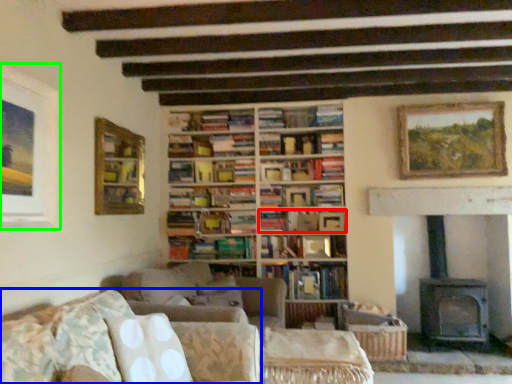
Question: Estimate the real-world distances between objects in this image. Which object is farther from book (highlighted by a red box), studio couch (highlighted by a blue box) or picture frame (highlighted by a green box)?

Choices:
 (A) studio couch
 (B) picture frame

Answer: (B)